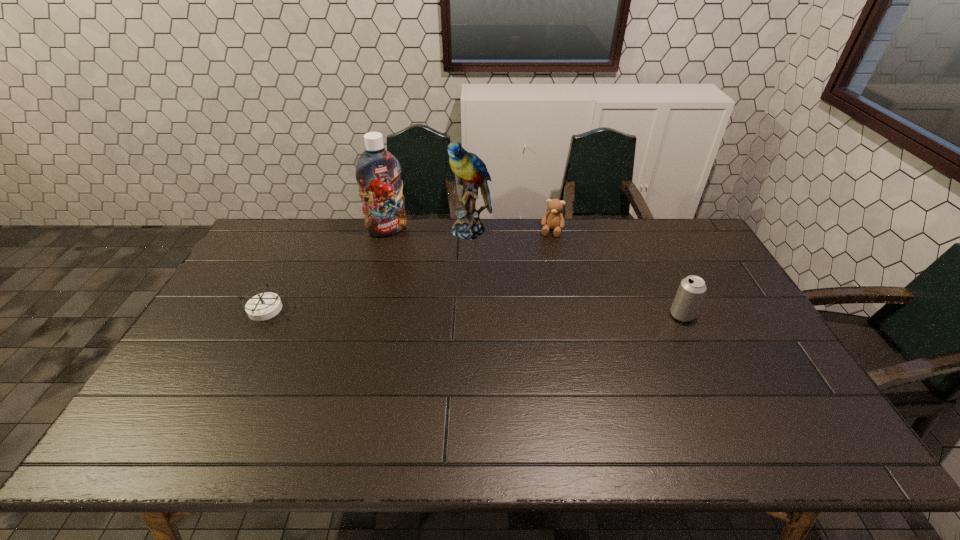
This screenshot has height=540, width=960. What are the coordinates of `vacant spot on the desktop that is between the compass and the beer can and is positioned on the face of the third object from right to left` in the screenshot? It's located at (424, 312).

You are a GUI agent. You are given a task and a screenshot of the screen. Output one action in this format:
    pyautogui.click(x=<x>, y=<y>)
    Task: Click on the vacant space on the desktop that is between the compass and the beer can and is positioned on the front label of the fourth object from right to left
    The height and width of the screenshot is (540, 960).
    Given the screenshot: What is the action you would take?
    pyautogui.click(x=445, y=312)

The width and height of the screenshot is (960, 540). I want to click on vacant space on the desktop that is between the shortest object and the rightmost object and is positioned on the front-facing side of the second object from right to left, so click(533, 313).